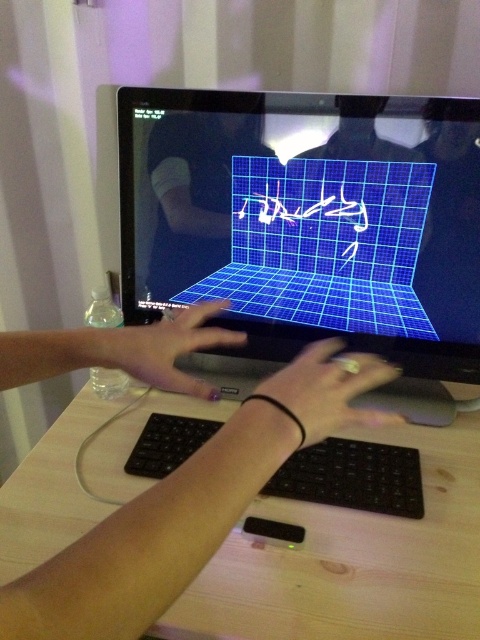
Can you confirm if matte black hands at center is wider than matte black hand at center?

In fact, matte black hands at center might be narrower than matte black hand at center.

Can you confirm if matte black hands at center is shorter than matte black hand at center?

No.

Which is behind, point (157, 189) or point (156, 365)?

The point (157, 189) is more distant.

The image size is (480, 640). In order to click on matte black hands at center in this screenshot , I will do `click(193, 193)`.

Is black matte keyboard at center in front of matte black hand at center?

That is False.

Is point (380, 464) positioned behind point (224, 336)?

Yes, point (380, 464) is behind point (224, 336).

Locate an element on the screen. The image size is (480, 640). black matte keyboard at center is located at coordinates (352, 477).

Which is above, light wood table at center or blue grid paper at center?

blue grid paper at center

The image size is (480, 640). What do you see at coordinates (357, 560) in the screenshot?
I see `light wood table at center` at bounding box center [357, 560].

Between point (79, 497) and point (345, 168), which one is positioned behind?

Point (345, 168)

The height and width of the screenshot is (640, 480). Identify the location of light wood table at center. (357, 560).